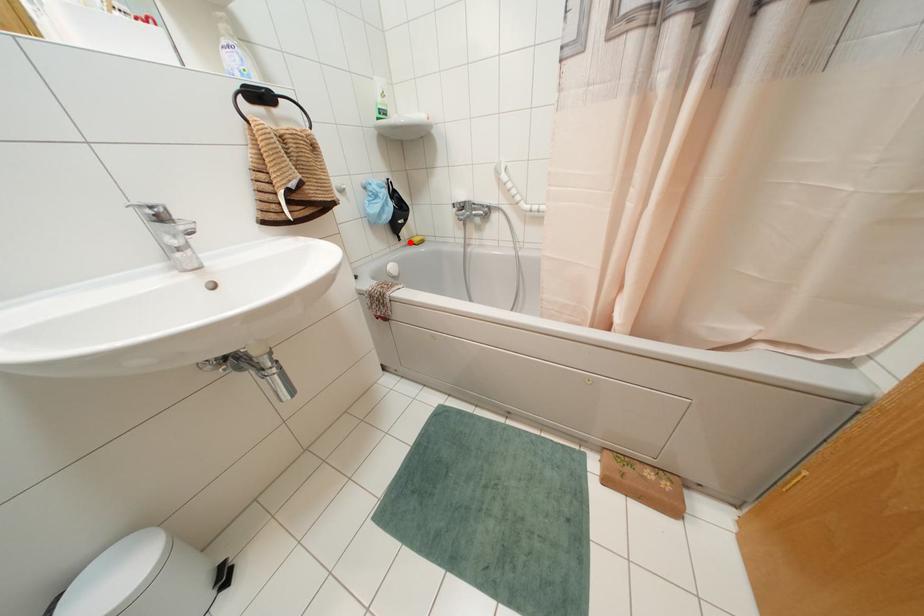
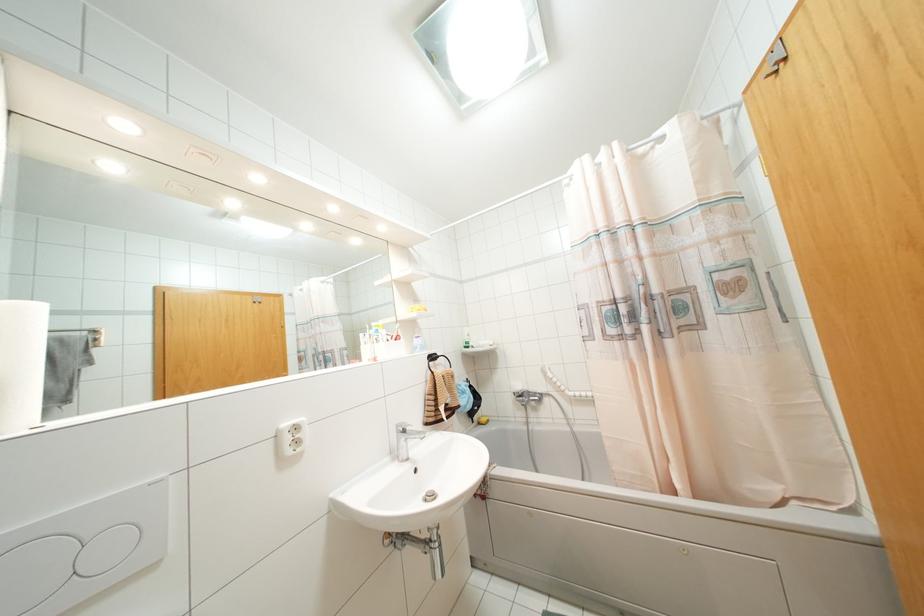
Find the pixel in the second image that matches the highlighted location in the first image.

(479, 423)